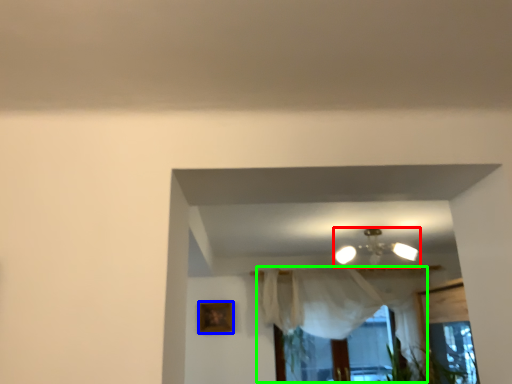
Question: Which is nearer to the lamp (highlighted by a red box)? picture frame (highlighted by a blue box) or curtain (highlighted by a green box).

Choices:
 (A) picture frame
 (B) curtain

Answer: (B)